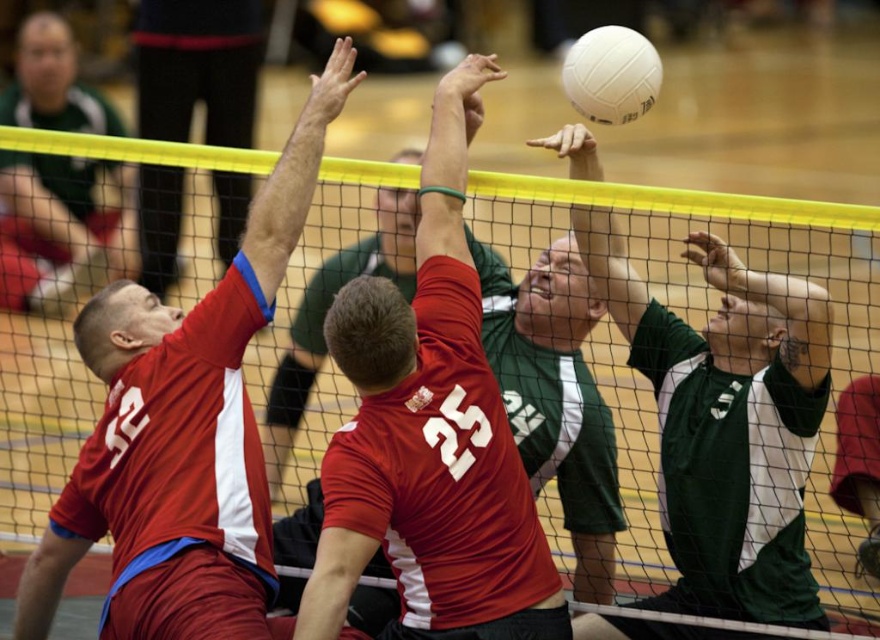
Question: Does matte red jersey at upper left have a lesser width compared to matte red jersey at center?

Choices:
 (A) no
 (B) yes

Answer: (A)

Question: Can you confirm if matte red jersey at center is positioned below white matte volleyball at upper center?

Choices:
 (A) no
 (B) yes

Answer: (B)

Question: Which of the following is the farthest from the observer?

Choices:
 (A) (589, 84)
 (B) (55, 609)
 (C) (468, 269)

Answer: (B)

Question: Which point is farther from the camera taking this photo?

Choices:
 (A) (251, 509)
 (B) (391, 433)
 (C) (614, 36)

Answer: (C)

Question: Does green jersey at upper center have a smaller size compared to white matte volleyball at upper center?

Choices:
 (A) yes
 (B) no

Answer: (A)

Question: Which point is farther to the camera?

Choices:
 (A) (654, 88)
 (B) (567, 616)
 (C) (178, 627)
 (D) (766, 477)

Answer: (D)